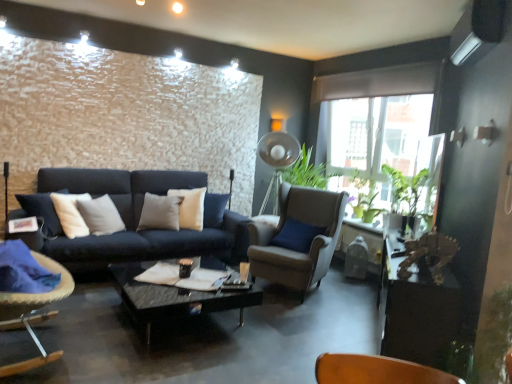
The image size is (512, 384). I want to click on wooden table at right, so click(419, 299).

Looking at this image, is suede beige armchair at center, the first chair when ordered from back to front, oriented towards velvet cushioned chair at left, the first chair from the front?

Yes, suede beige armchair at center, the first chair when ordered from back to front, faces towards velvet cushioned chair at left, the first chair from the front.

In terms of size, does suede beige armchair at center, positioned as the second chair in left-to-right order, appear bigger or smaller than velvet cushioned chair at left, marked as the second chair in a back-to-front arrangement?

Considering their sizes, suede beige armchair at center, positioned as the second chair in left-to-right order, takes up more space than velvet cushioned chair at left, marked as the second chair in a back-to-front arrangement.

From the image's perspective, is suede beige armchair at center, marked as the first chair in a right-to-left arrangement, under velvet cushioned chair at left, marked as the second chair in a back-to-front arrangement?

No, from the image's perspective, suede beige armchair at center, marked as the first chair in a right-to-left arrangement, is not beneath velvet cushioned chair at left, marked as the second chair in a back-to-front arrangement.

Is green matte plant at right located within black glass coffee table at center?

That's incorrect, green matte plant at right is not inside black glass coffee table at center.

What's the angular difference between black glass coffee table at center and green matte plant at right's facing directions?

They differ by 2.8 degrees in their facing directions.

Which is more to the left, black glass coffee table at center or green matte plant at right?

From the viewer's perspective, black glass coffee table at center appears more on the left side.

Which of these two, black glass coffee table at center or green matte plant at right, is smaller?

Smaller between the two is green matte plant at right.

Is velvet cushioned chair at left, the first chair in the left-to-right sequence, facing towards wooden table at right?

Yes.

Can you confirm if velvet cushioned chair at left, marked as the second chair in a back-to-front arrangement, is smaller than wooden table at right?

Indeed, velvet cushioned chair at left, marked as the second chair in a back-to-front arrangement, has a smaller size compared to wooden table at right.

What are the coordinates of `table lying on the right of velvet cushioned chair at left, marked as the second chair in a back-to-front arrangement` in the screenshot? It's located at (419, 299).

Does velvet cushioned chair at left, marked as the second chair in a back-to-front arrangement, lie behind wooden table at right?

That is False.

Which is behind, wooden table at right or suede beige armchair at center, the first chair when ordered from back to front?

suede beige armchair at center, the first chair when ordered from back to front, is more distant.

Does wooden table at right have a lesser width compared to suede beige armchair at center, the first chair when ordered from back to front?

Yes.

Is wooden table at right not within suede beige armchair at center, which appears as the second chair when viewed from the front?

Yes, wooden table at right is located beyond the bounds of suede beige armchair at center, which appears as the second chair when viewed from the front.

From a real-world perspective, is wooden table at right positioned above or below suede beige armchair at center, positioned as the second chair in left-to-right order?

In terms of real-world spatial position, wooden table at right is below suede beige armchair at center, positioned as the second chair in left-to-right order.

From the image's perspective, between green matte plant at right and black glass coffee table at center, which one is located above?

green matte plant at right appears higher in the image.

Which object is positioned more to the left, green matte plant at right or black glass coffee table at center?

From the viewer's perspective, black glass coffee table at center appears more on the left side.

Which of these two, green matte plant at right or black glass coffee table at center, is bigger?

With larger size is black glass coffee table at center.

Is velvet cushioned chair at left, marked as the second chair in a back-to-front arrangement, facing away from green matte plant at right?

No, velvet cushioned chair at left, marked as the second chair in a back-to-front arrangement, is not facing away from green matte plant at right.

Which is farther, (x=4, y=324) or (x=378, y=212)?

Positioned behind is point (x=378, y=212).

Who is taller, velvet cushioned chair at left, marked as the second chair in a back-to-front arrangement, or green matte plant at right?

velvet cushioned chair at left, marked as the second chair in a back-to-front arrangement.

Can you confirm if suede beige armchair at center, marked as the first chair in a right-to-left arrangement, is smaller than green matte plant at right?

No.

From a real-world perspective, is suede beige armchair at center, positioned as the second chair in left-to-right order, below green matte plant at right?

Yes, from a real-world perspective, suede beige armchair at center, positioned as the second chair in left-to-right order, is beneath green matte plant at right.

This screenshot has height=384, width=512. I want to click on chair that is the 1st one when counting downward from the green matte plant at right (from the image's perspective), so click(x=298, y=251).

Can you confirm if suede beige armchair at center, marked as the first chair in a right-to-left arrangement, is taller than green matte plant at right?

Indeed, suede beige armchair at center, marked as the first chair in a right-to-left arrangement, has a greater height compared to green matte plant at right.

Image resolution: width=512 pixels, height=384 pixels. Identify the location of chair located in front of the suede beige armchair at center, which appears as the second chair when viewed from the front. (29, 294).

Where is `plant above the black glass coffee table at center (from a real-world perspective)`? plant above the black glass coffee table at center (from a real-world perspective) is located at coordinates (364, 196).

From the image, which object appears to be nearer to green matte plant at right, wooden table at right or black glass coffee table at center?

wooden table at right.

Based on their spatial positions, is black glass coffee table at center or green matte plant at right further from suede beige armchair at center, which appears as the second chair when viewed from the front?

The object further to suede beige armchair at center, which appears as the second chair when viewed from the front, is green matte plant at right.

Looking at the image, which one is located further to black glass coffee table at center, suede beige armchair at center, which appears as the second chair when viewed from the front, or green matte plant at right?

green matte plant at right lies further to black glass coffee table at center than the other object.

When comparing their distances from green matte plant at right, does suede beige armchair at center, positioned as the second chair in left-to-right order, or black glass coffee table at center seem closer?

The object closer to green matte plant at right is suede beige armchair at center, positioned as the second chair in left-to-right order.

Estimate the real-world distances between objects in this image. Which object is closer to velvet cushioned chair at left, which ranks as the 2th chair in right-to-left order, suede beige armchair at center, the first chair when ordered from back to front, or green matte plant at right?

Based on the image, suede beige armchair at center, the first chair when ordered from back to front, appears to be nearer to velvet cushioned chair at left, which ranks as the 2th chair in right-to-left order.

Based on their spatial positions, is wooden table at right or green matte plant at right further from velvet cushioned chair at left, which ranks as the 2th chair in right-to-left order?

Among the two, green matte plant at right is located further to velvet cushioned chair at left, which ranks as the 2th chair in right-to-left order.

From the image, which object appears to be nearer to green matte plant at right, black glass coffee table at center or velvet cushioned chair at left, marked as the second chair in a back-to-front arrangement?

black glass coffee table at center is closer to green matte plant at right.

Which object lies further to the anchor point green matte plant at right, black glass coffee table at center or suede beige armchair at center, positioned as the second chair in left-to-right order?

Based on the image, black glass coffee table at center appears to be further to green matte plant at right.

Find the location of a particular element. Image resolution: width=512 pixels, height=384 pixels. chair between velvet cushioned chair at left, the first chair in the left-to-right sequence, and wooden table at right is located at coordinates (298, 251).

Where is `coffee table located between wooden table at right and green matte plant at right in the depth direction`? coffee table located between wooden table at right and green matte plant at right in the depth direction is located at coordinates (174, 298).

I want to click on chair between black glass coffee table at center and wooden table at right in the horizontal direction, so [x=298, y=251].

You are a GUI agent. You are given a task and a screenshot of the screen. Output one action in this format:
    pyautogui.click(x=<x>, y=<y>)
    Task: Click on the coffee table located between velvet cushioned chair at left, the first chair in the left-to-right sequence, and wooden table at right in the left-right direction
    This screenshot has height=384, width=512.
    Given the screenshot: What is the action you would take?
    click(x=174, y=298)